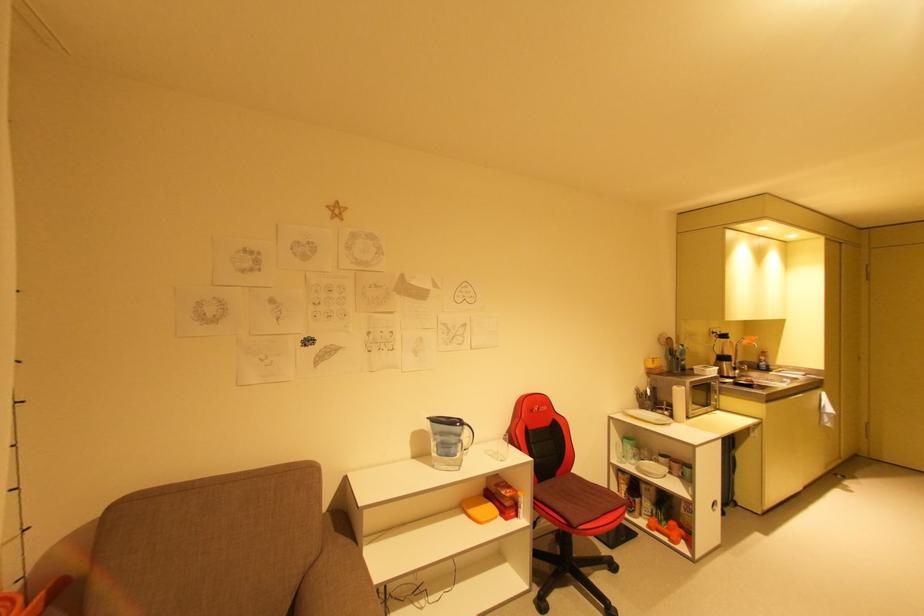
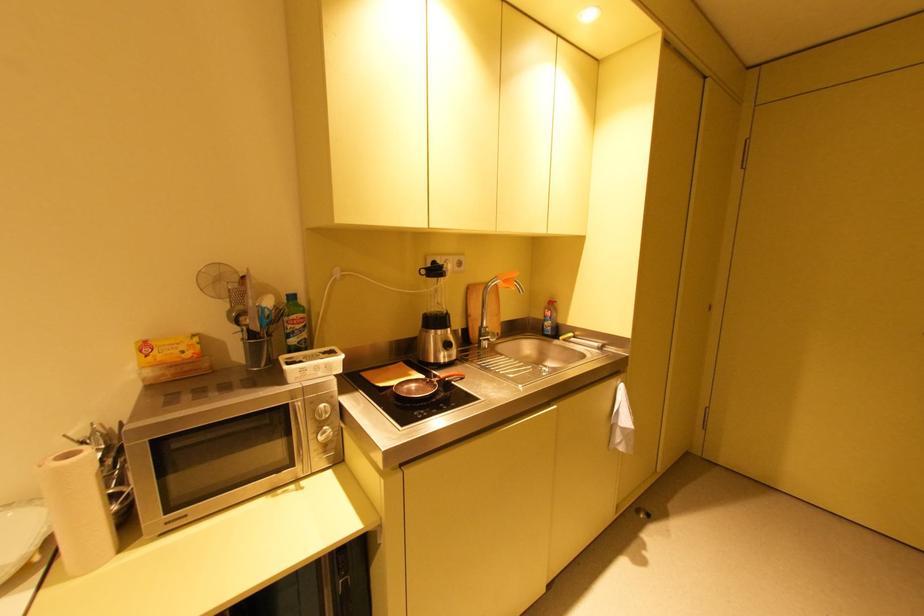
Find the pixel in the second image that matches the point at 766,363 in the first image.

(551, 323)